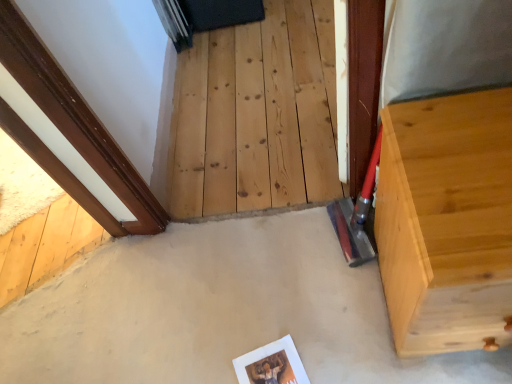
Question: From the image's perspective, is light wood dresser at right above or below natural wood stairwell at center?

Choices:
 (A) below
 (B) above

Answer: (A)

Question: Would you say light wood dresser at right is inside or outside natural wood stairwell at center?

Choices:
 (A) inside
 (B) outside

Answer: (B)

Question: Which object is positioned closest to the natural wood stairwell at center?

Choices:
 (A) light wood dresser at right
 (B) smooth concrete at center

Answer: (B)

Question: Considering the real-world distances, which object is closest to the natural wood stairwell at center?

Choices:
 (A) light wood dresser at right
 (B) smooth concrete at center

Answer: (B)